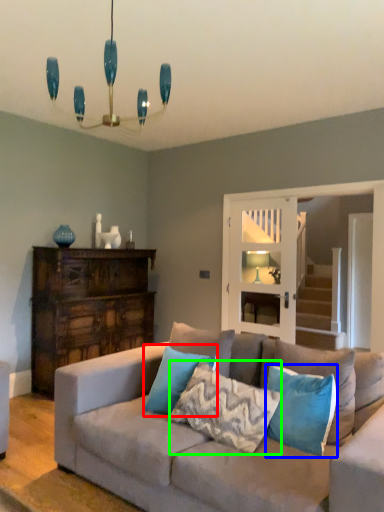
Question: Which is farther away from pillow (highlighted by a red box)? pillow (highlighted by a blue box) or pillow (highlighted by a green box)?

Choices:
 (A) pillow
 (B) pillow

Answer: (A)